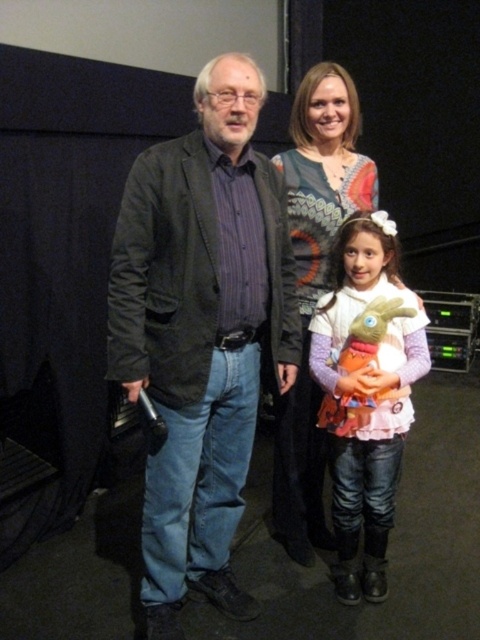
Does dark gray textured blazer at center appear under pink fluffy dress at center?

Actually, dark gray textured blazer at center is above pink fluffy dress at center.

Can you confirm if dark gray textured blazer at center is smaller than pink fluffy dress at center?

No, dark gray textured blazer at center is not smaller than pink fluffy dress at center.

Between point (184, 419) and point (343, 516), which one is positioned in front?

Point (184, 419) is in front.

This screenshot has width=480, height=640. Identify the location of dark gray textured blazer at center. (202, 332).

Looking at this image, is dark gray textured blazer at center smaller than knitted sweater at center?

Correct, dark gray textured blazer at center occupies less space than knitted sweater at center.

Identify the location of dark gray textured blazer at center. (202, 332).

Who is more distant from viewer, [346,275] or [301,540]?

The point [301,540] is more distant.

The height and width of the screenshot is (640, 480). Find the location of `pink fluffy dress at center`. pink fluffy dress at center is located at coordinates coord(365,392).

Does point (370, 250) lie behind point (319, 100)?

That is False.

Identify the location of pink fluffy dress at center. Image resolution: width=480 pixels, height=640 pixels. (365, 392).